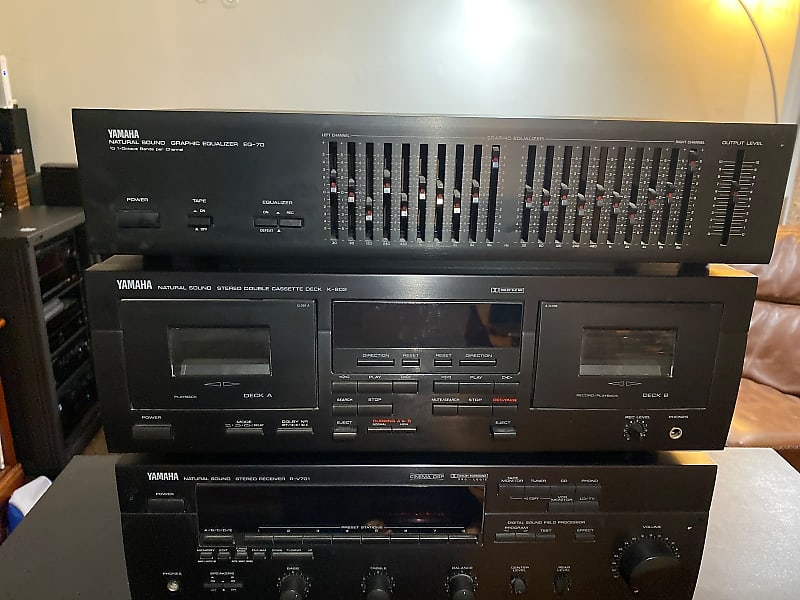
This screenshot has height=600, width=800. I want to click on front of stereo, so click(x=354, y=343), click(x=502, y=598).